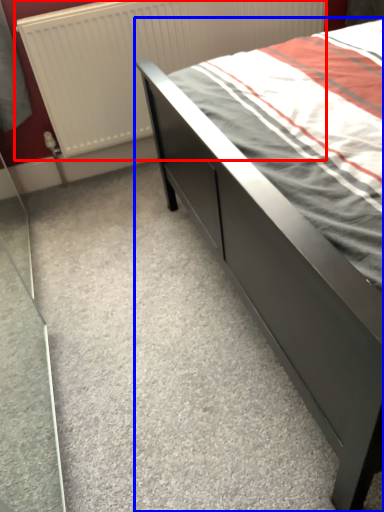
Question: Which point is closer to the camera, radiator (highlighted by a red box) or bed (highlighted by a blue box)?

Choices:
 (A) radiator
 (B) bed

Answer: (B)